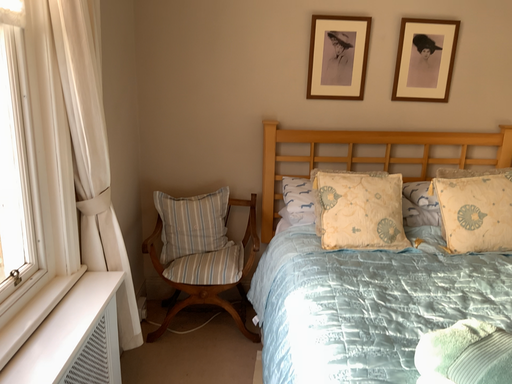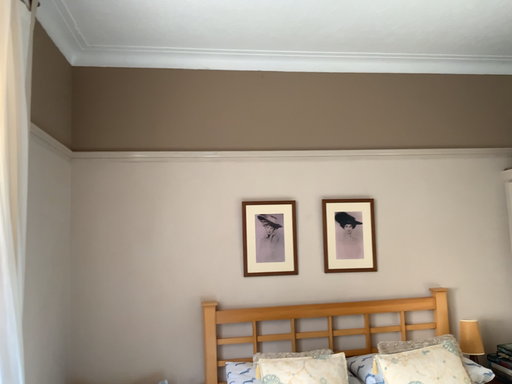
Question: How did the camera likely rotate when shooting the video?

Choices:
 (A) rotated downward
 (B) rotated upward

Answer: (B)